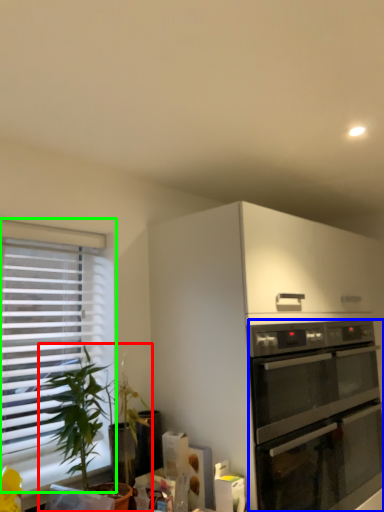
Question: Estimate the real-world distances between objects in this image. Which object is farther from houseplant (highlighted by a red box), oven (highlighted by a blue box) or window (highlighted by a green box)?

Choices:
 (A) oven
 (B) window

Answer: (A)